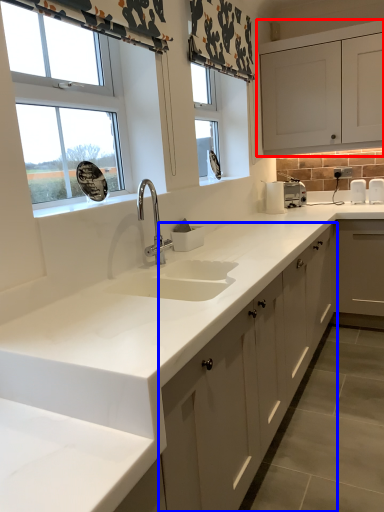
Question: Which point is further to the camera, cabinetry (highlighted by a red box) or cabinetry (highlighted by a blue box)?

Choices:
 (A) cabinetry
 (B) cabinetry

Answer: (A)